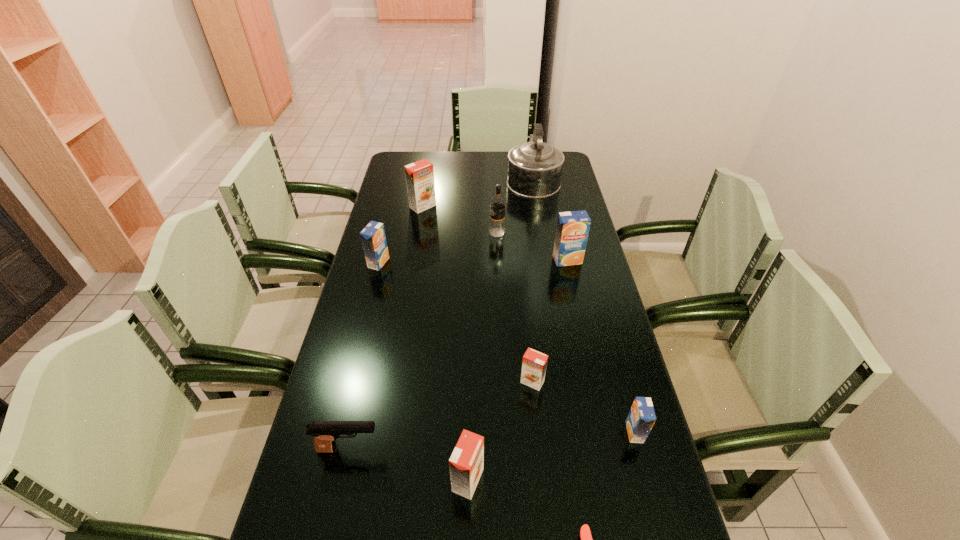
The height and width of the screenshot is (540, 960). Identify the location of the farthest object. (535, 168).

What are the coordinates of `gray kettle` in the screenshot? It's located at (535, 168).

Find the location of a particular element. The width and height of the screenshot is (960, 540). the sixth object from right to left is located at coordinates (497, 203).

What are the coordinates of `the eighth nearest object` in the screenshot? It's located at (497, 203).

Find the location of `the second farthest object`. the second farthest object is located at coordinates (419, 175).

This screenshot has height=540, width=960. Identify the location of the farthest orange orange juice. pos(419,175).

This screenshot has width=960, height=540. What are the coordinates of `the fifth orange_juice from left to right` in the screenshot? It's located at (572, 230).

Where is `the second blue orange_juice from right to left`? the second blue orange_juice from right to left is located at coordinates (572, 230).

Find the location of a particular element. The height and width of the screenshot is (540, 960). the second smallest blue orange_juice is located at coordinates (373, 238).

Where is `the leftmost orange_juice`? the leftmost orange_juice is located at coordinates (373, 238).